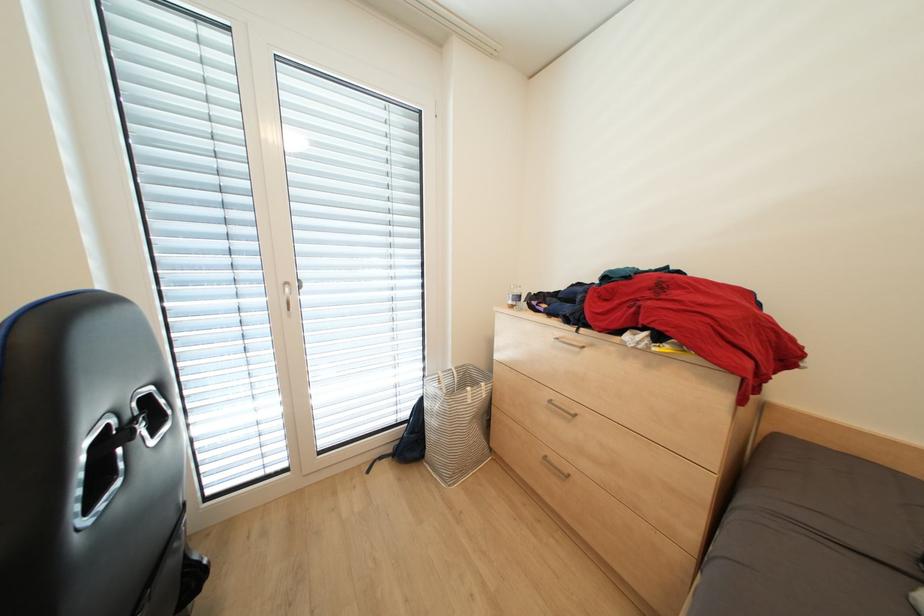
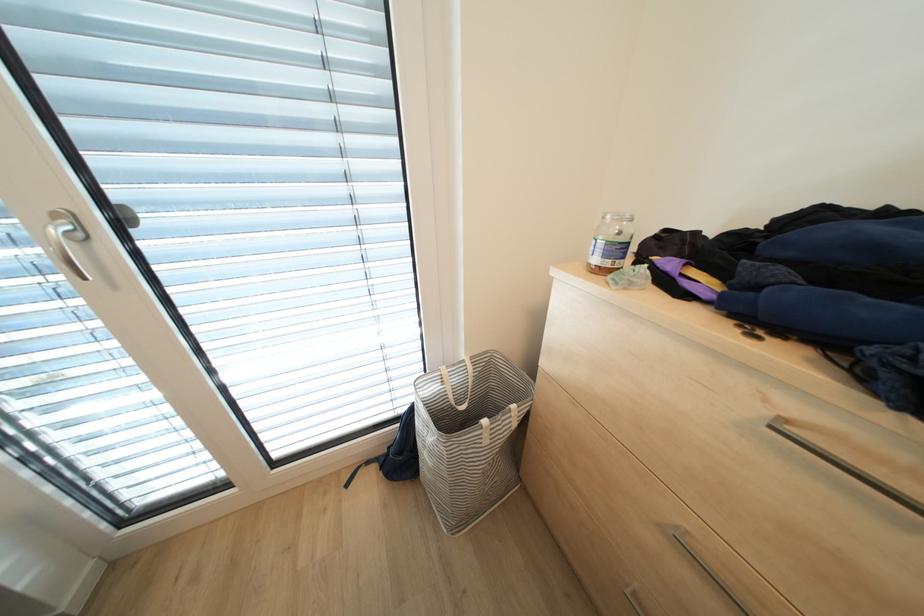
Question: How did the camera likely rotate?

Choices:
 (A) Left
 (B) Right
 (C) Up
 (D) Down

Answer: (D)